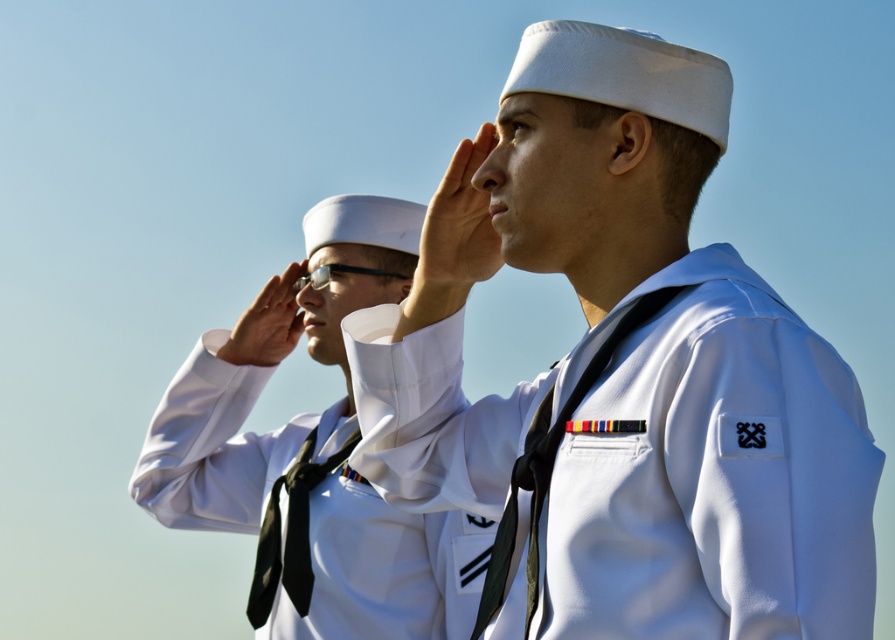
In the scene shown: Is the position of white matte uniform at center more distant than that of white matte sailor uniform at center?

No, white matte uniform at center is closer to the viewer.

Between point (851, 596) and point (373, 577), which one is positioned in front?

Point (851, 596)

Where is `white matte uniform at center`? white matte uniform at center is located at coordinates tap(621, 372).